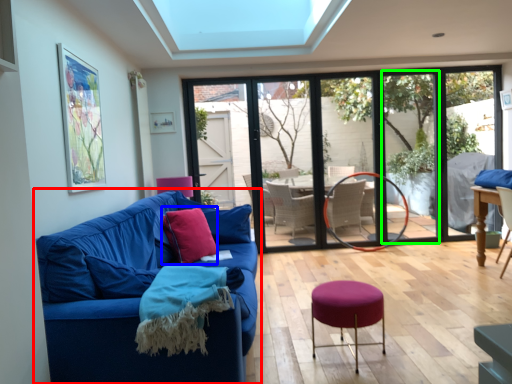
Question: Which object is positioned farthest from studio couch (highlighted by a red box)? Select from throw pillow (highlighted by a blue box) and window screen (highlighted by a green box).

Choices:
 (A) throw pillow
 (B) window screen

Answer: (B)